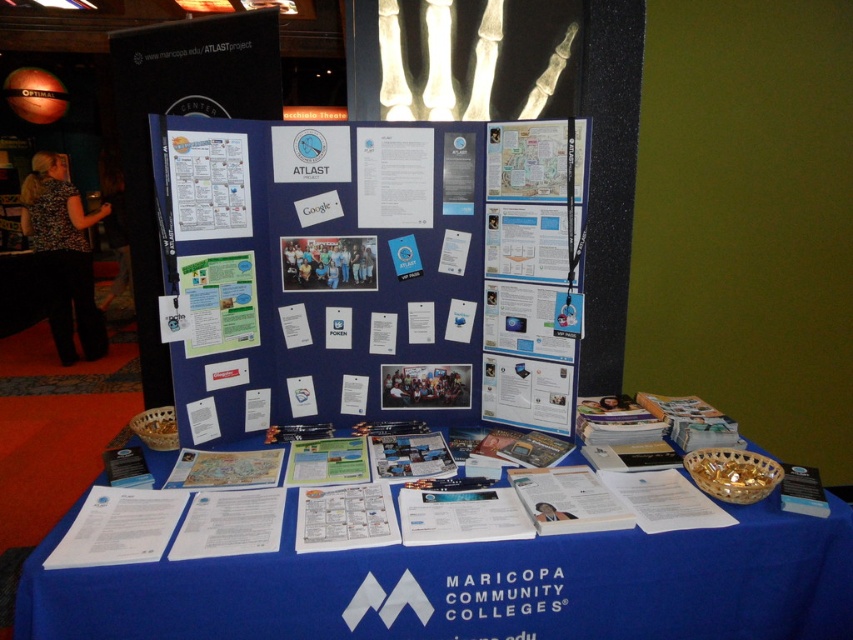
Which object is taller between the blue paperboard poster at center and the white paper at center?

The blue paperboard poster at center is taller than the white paper at center.

You are a student looking at the Maricopa Community Colleges display. You notice two papers on the backdrop. The white paper at upper left and the green paper at center. Which paper is taller?

The white paper at upper left is taller than the green paper at center.